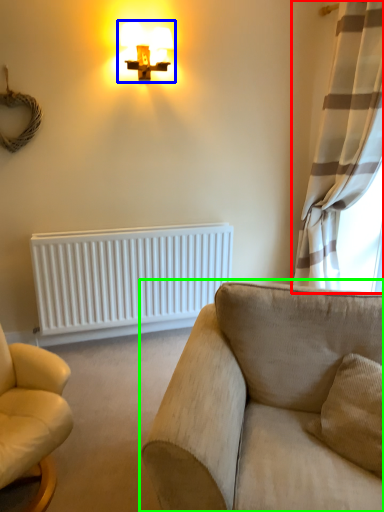
Question: Based on their relative distances, which object is nearer to curtain (highlighted by a red box)? Choose from lamp (highlighted by a blue box) and studio couch (highlighted by a green box).

Choices:
 (A) lamp
 (B) studio couch

Answer: (A)